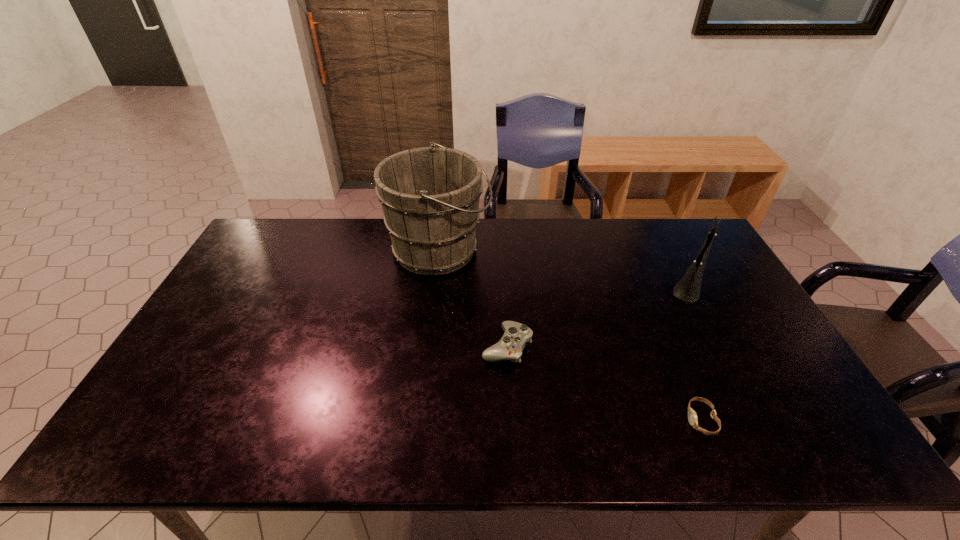
This screenshot has height=540, width=960. What are the coordinates of `vacant area at the far left corner of the desktop` in the screenshot? It's located at (276, 222).

The width and height of the screenshot is (960, 540). Identify the location of vacant area that lies between the tallest object and the second shortest object. (473, 298).

The height and width of the screenshot is (540, 960). What are the coordinates of `vacant point located between the watch and the shoulder bag` in the screenshot? It's located at (696, 353).

The width and height of the screenshot is (960, 540). In order to click on empty location between the tallest object and the second object from right to left in this screenshot , I will do `click(570, 335)`.

At what (x,y) coordinates should I click in order to perform the action: click on free spot between the second shortest object and the watch. Please return your answer as a coordinate pair (x, y). This screenshot has height=540, width=960. Looking at the image, I should click on (604, 383).

Where is `empty location between the control and the tallest object`? The width and height of the screenshot is (960, 540). empty location between the control and the tallest object is located at coordinates (473, 298).

Where is `free space between the rightmost object and the watch`? The image size is (960, 540). free space between the rightmost object and the watch is located at coordinates (696, 353).

Identify the location of vacant region between the second shortest object and the third shortest object. Image resolution: width=960 pixels, height=540 pixels. (599, 316).

Locate an element on the screen. free space between the tallest object and the rightmost object is located at coordinates (564, 268).

Where is `free space between the second shortest object and the third shortest object`? free space between the second shortest object and the third shortest object is located at coordinates (599, 316).